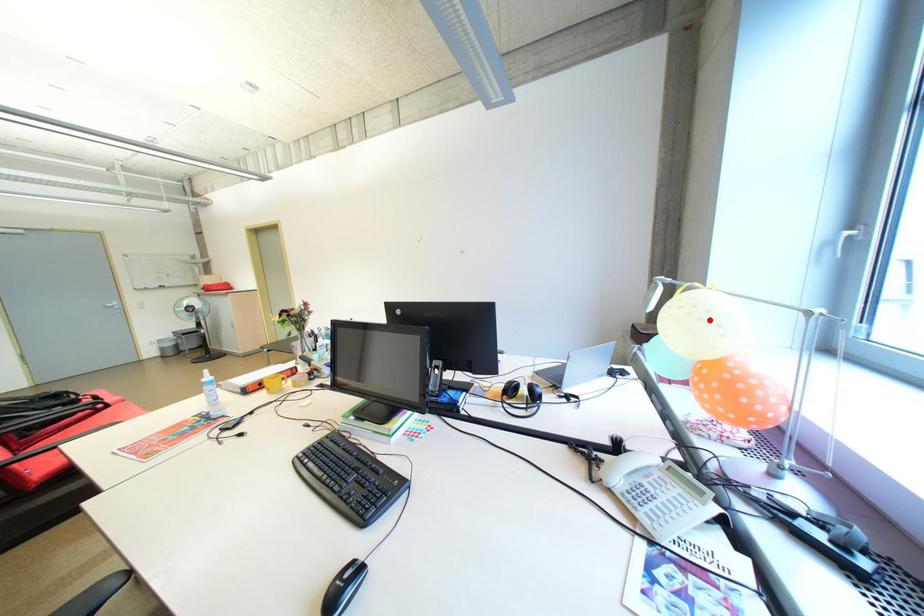
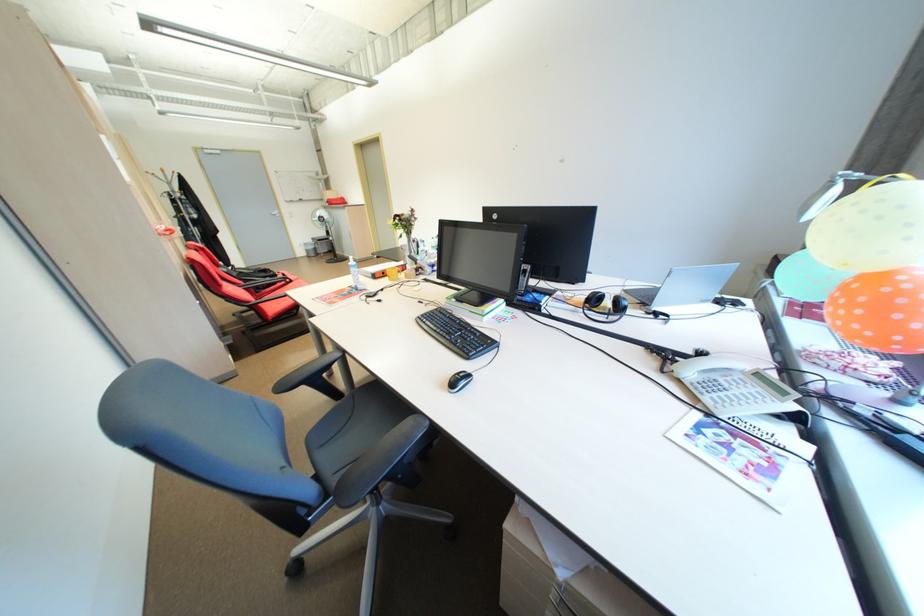
The point at the highlighted location is marked in the first image. Where is the corresponding point in the second image?

(889, 219)